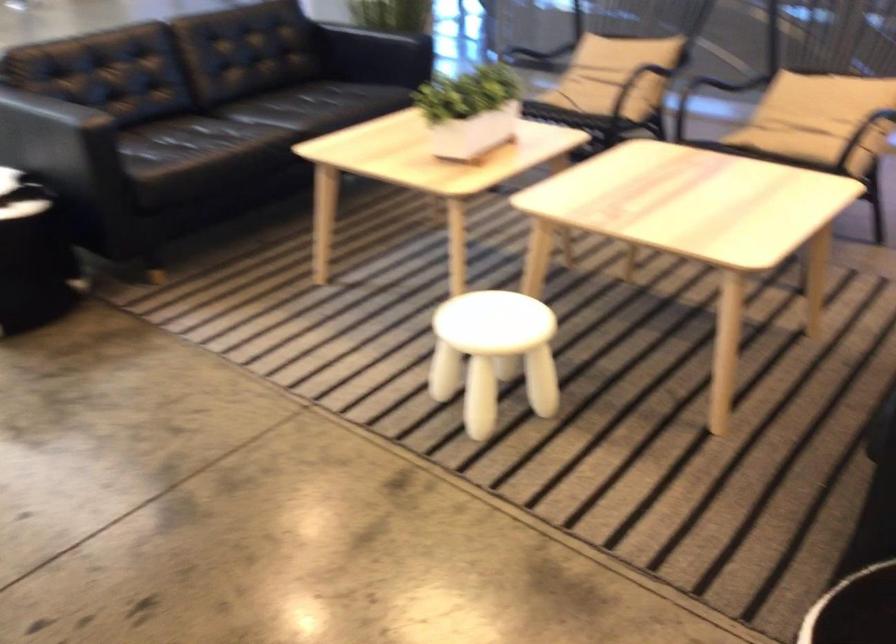
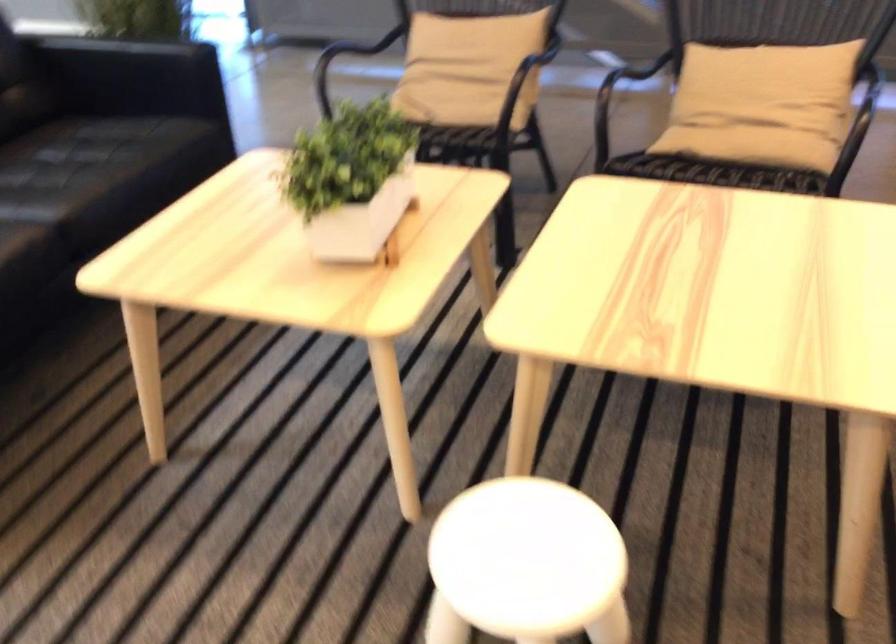
Question: The camera is either moving clockwise (left) or counter-clockwise (right) around the object. The first image is from the beginning of the video and the second image is from the end. Is the camera moving left or right when shooting the video?

Choices:
 (A) Left
 (B) Right

Answer: (A)